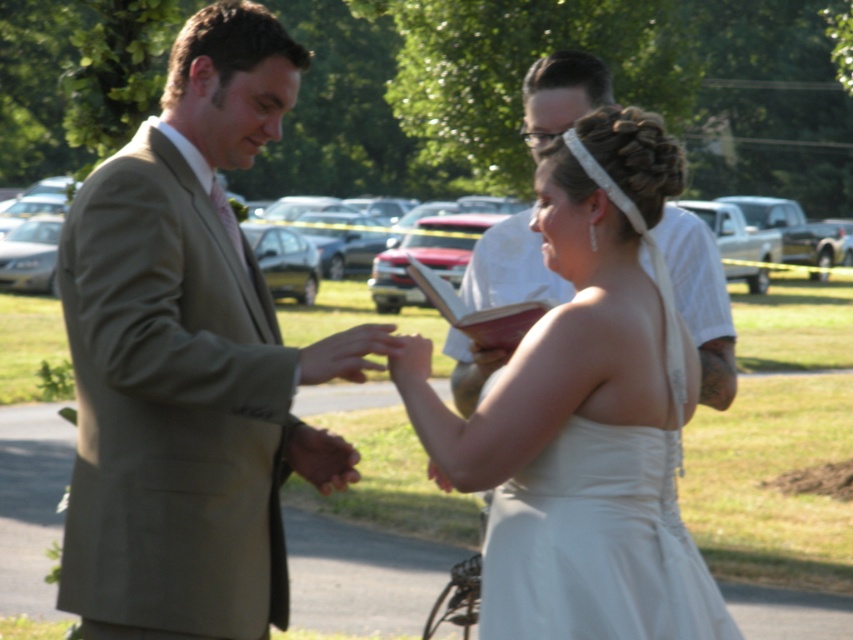
Question: Does white satin dress at center appear over white textured book at upper center?

Choices:
 (A) yes
 (B) no

Answer: (B)

Question: Is light brown suit at center to the right of white textured book at upper center from the viewer's perspective?

Choices:
 (A) yes
 (B) no

Answer: (B)

Question: Estimate the real-world distances between objects in this image. Which object is closer to the white satin dress at center?

Choices:
 (A) white textured book at upper center
 (B) light brown suit at center

Answer: (B)

Question: Can you confirm if light brown suit at center is positioned to the left of white textured book at upper center?

Choices:
 (A) no
 (B) yes

Answer: (B)

Question: Which of the following is the farthest from the observer?

Choices:
 (A) light brown suit at center
 (B) white satin dress at center
 (C) white textured book at upper center

Answer: (C)

Question: Estimate the real-world distances between objects in this image. Which object is farther from the light brown suit at center?

Choices:
 (A) white textured book at upper center
 (B) white satin dress at center

Answer: (A)